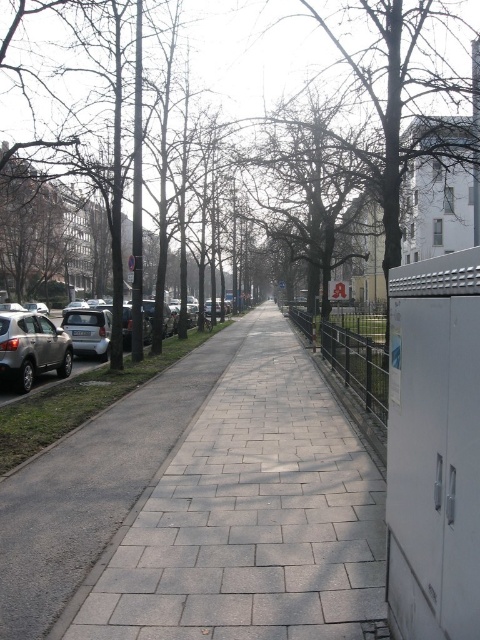
Question: Considering the real-world distances, which object is closest to the gray concrete pavement at center?

Choices:
 (A) silver metallic car at left
 (B) metallic wire fence at center-right
 (C) satin silver suv at left

Answer: (B)

Question: Is metallic wire fence at center-right below silver metallic car at left?

Choices:
 (A) yes
 (B) no

Answer: (B)

Question: Can you confirm if gray concrete pavement at center is positioned above metallic wire fence at center-right?

Choices:
 (A) no
 (B) yes

Answer: (A)

Question: Which object appears farthest from the camera in this image?

Choices:
 (A) gray concrete pavement at center
 (B) silver metallic car at left

Answer: (B)

Question: Estimate the real-world distances between objects in this image. Which object is farther from the metallic wire fence at center-right?

Choices:
 (A) satin silver suv at left
 (B) gray concrete pavement at center

Answer: (A)

Question: Does gray concrete pavement at center appear under metallic wire fence at center-right?

Choices:
 (A) no
 (B) yes

Answer: (B)